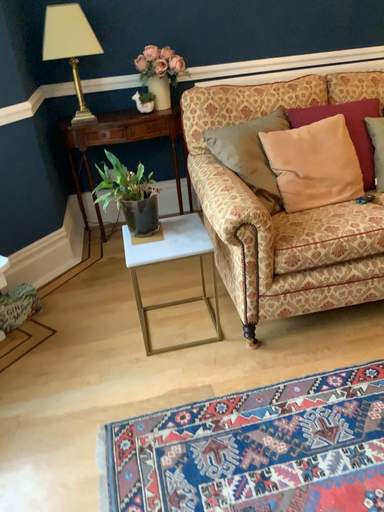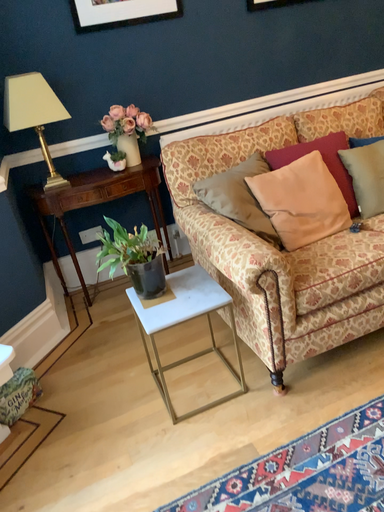
Question: Which way did the camera rotate in the video?

Choices:
 (A) rotated left
 (B) rotated right

Answer: (B)